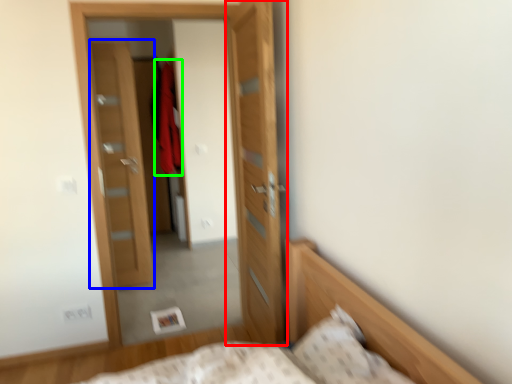
Question: Which object is positioned closest to door (highlighted by a red box)? Select from door (highlighted by a blue box) and robe (highlighted by a green box).

Choices:
 (A) door
 (B) robe

Answer: (A)